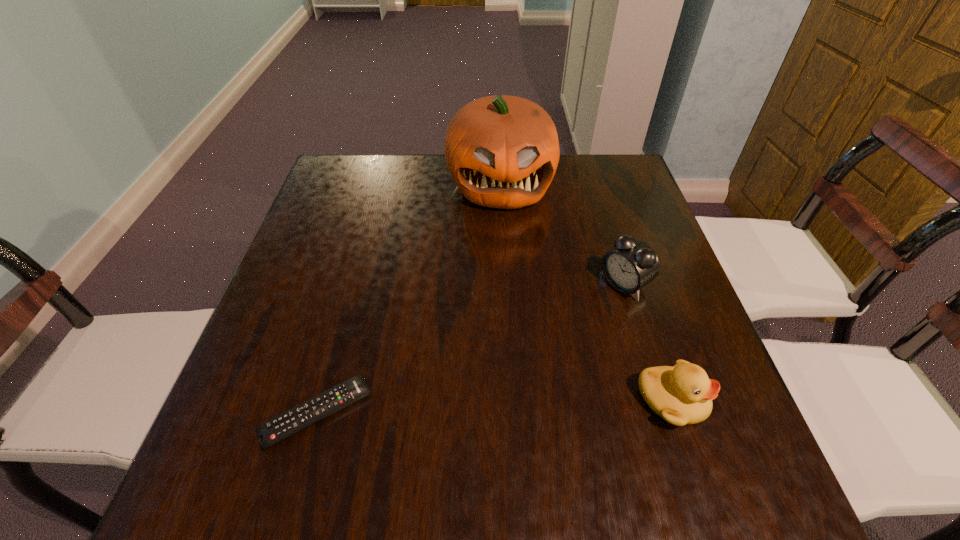
I want to click on vacant space located 0.290m on the front side of the alarm clock, so click(x=513, y=370).

This screenshot has height=540, width=960. In order to click on vacant space located 0.130m on the face of the pumpkin in this screenshot , I will do `click(508, 250)`.

Identify the location of free space located 0.200m on the face of the pumpkin. The image size is (960, 540). (511, 270).

This screenshot has width=960, height=540. Identify the location of vacant space located on the face of the pumpkin. (516, 320).

Where is `object that is at the far edge`? The width and height of the screenshot is (960, 540). object that is at the far edge is located at coordinates (502, 151).

Identify the location of remote control at the near edge. This screenshot has width=960, height=540. (271, 432).

Identify the location of duckling located at the near edge. The height and width of the screenshot is (540, 960). (682, 395).

Where is `object positioned at the left edge`? object positioned at the left edge is located at coordinates (271, 432).

The height and width of the screenshot is (540, 960). I want to click on duckling at the right edge, so click(682, 395).

Where is `alarm clock that is at the right edge`? This screenshot has height=540, width=960. alarm clock that is at the right edge is located at coordinates (632, 264).